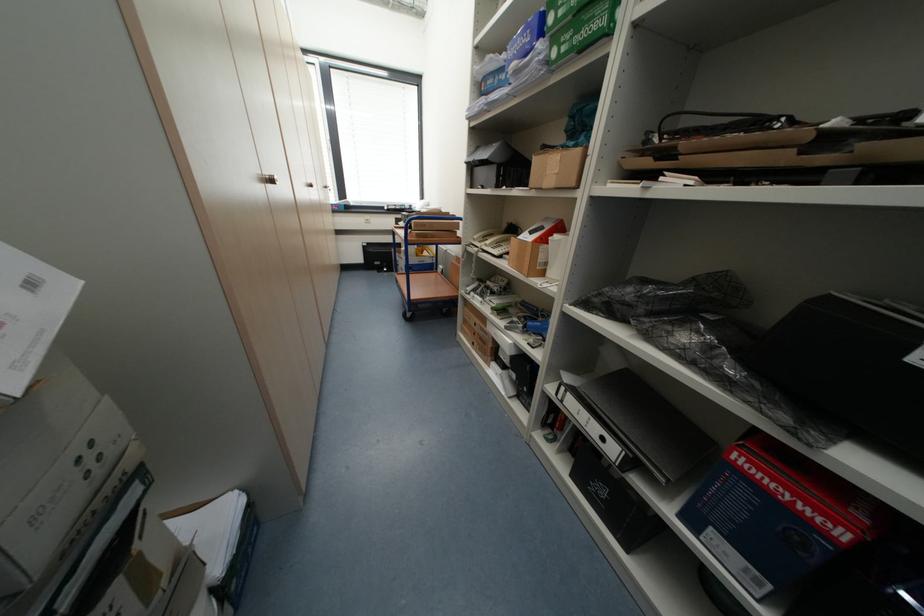
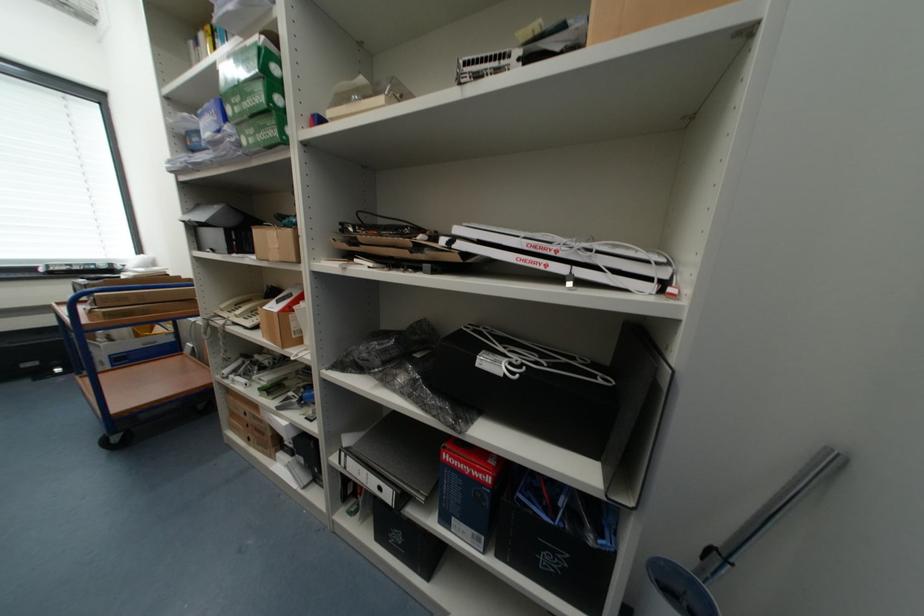
Question: The camera is either moving clockwise (left) or counter-clockwise (right) around the object. The first image is from the beginning of the video and the second image is from the end. Is the camera moving left or right when shooting the video?

Choices:
 (A) Left
 (B) Right

Answer: (A)